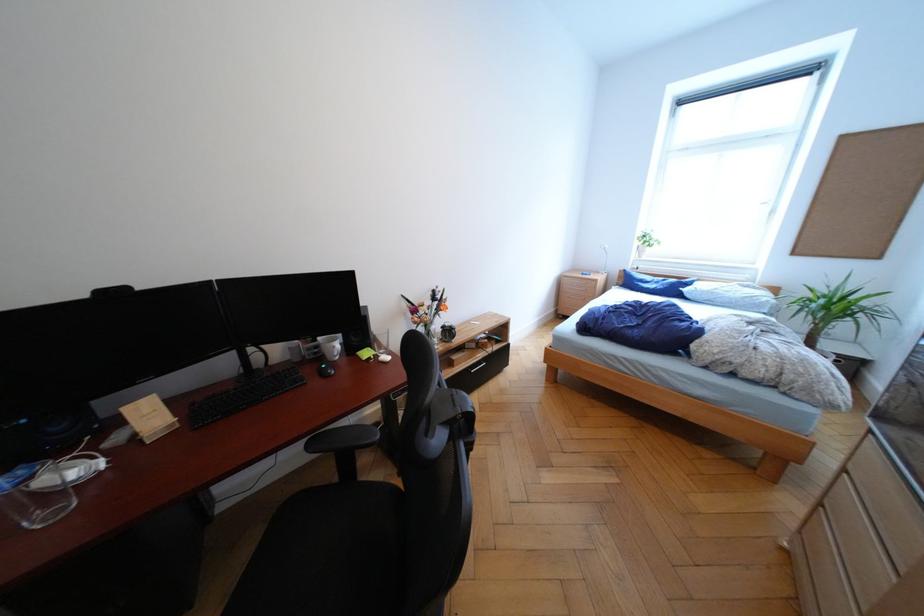
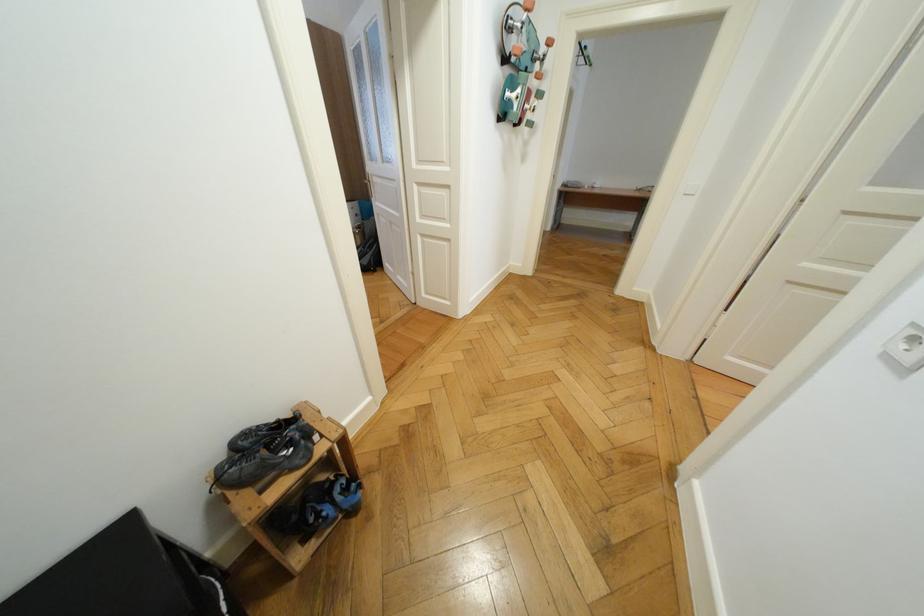
Question: I am providing you with two images of the same scene from different viewpoints. Please identify which objects are invisible in image2.

Choices:
 (A) white mug handle
 (B) black athletic shoe
 (C) blue and black shoe
 (D) white bookend

Answer: (A)